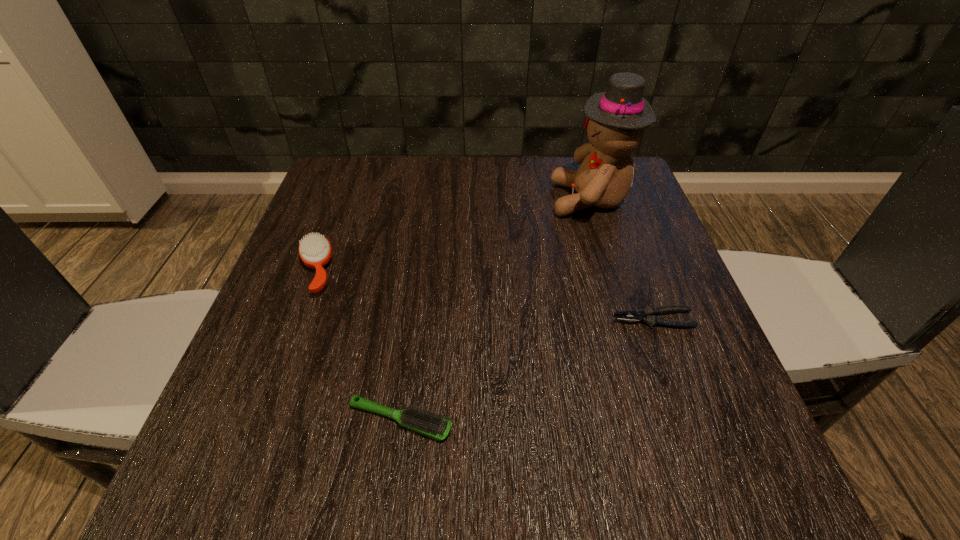
Locate which object is the second closest to the farthest object. Please provide its 2D coordinates. Your answer should be formatted as a tuple, i.e. [(x, y)], where the tuple contains the x and y coordinates of a point satisfying the conditions above.

[(315, 251)]

Where is `vacant space that satisfies the following two spatial constraints: 1. on the front side of the nearer hairbrush; 2. on the left side of the farther hairbrush`? vacant space that satisfies the following two spatial constraints: 1. on the front side of the nearer hairbrush; 2. on the left side of the farther hairbrush is located at coordinates (259, 421).

You are a GUI agent. You are given a task and a screenshot of the screen. Output one action in this format:
    pyautogui.click(x=<x>, y=<y>)
    Task: Click on the free spot that satisfies the following two spatial constraints: 1. on the front-facing side of the rag_doll; 2. on the front side of the taller hairbrush
    
    Given the screenshot: What is the action you would take?
    pos(612,271)